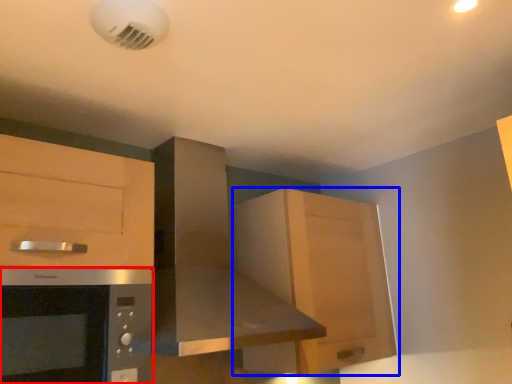
Question: Which object is further to the camera taking this photo, microwave oven (highlighted by a red box) or cabinetry (highlighted by a blue box)?

Choices:
 (A) microwave oven
 (B) cabinetry

Answer: (B)